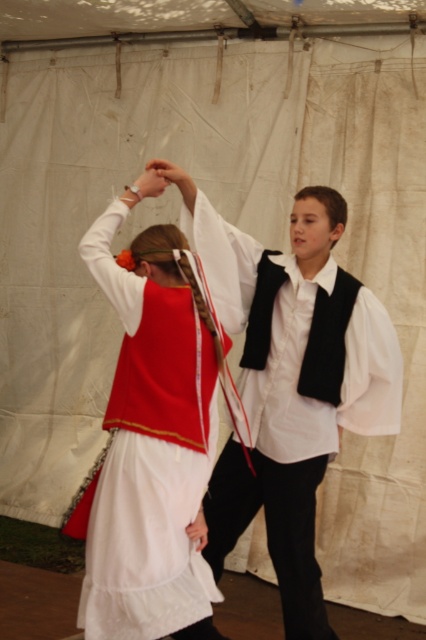
You are a photographer at the event and need to capture both the white matte vest at center and the matte red vest at center in a single frame. Which vest should you focus on first to ensure both are in the frame?

The white matte vest at center is much taller than the matte red vest at center, so you should focus on the white matte vest at center first to ensure both are in the frame.

You are a photographer at the event and need to capture both the white matte vest at center and the matte red vest at center in a single frame. Based on their positions, which vest should you focus on first to ensure both are in the shot?

The white matte vest at center is located below the matte red vest at center, so you should focus on the matte red vest at center first to ensure both are in the frame.

You are a photographer at the event and need to capture a photo where both the white matte vest at center and the matte red vest at center are visible. Based on their positions, which vest should you focus on first to ensure both are in frame?

The white matte vest at center is to the right of the matte red vest at center. To capture both in the frame, focus on the matte red vest at center first as it is on the left, allowing the white matte vest at center to naturally fall into the right side of the frame.